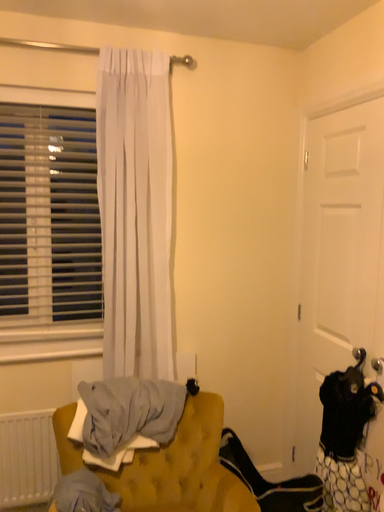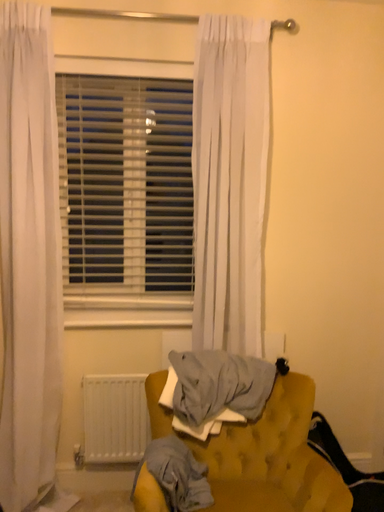
Question: How did the camera likely rotate when shooting the video?

Choices:
 (A) rotated left
 (B) rotated right

Answer: (A)